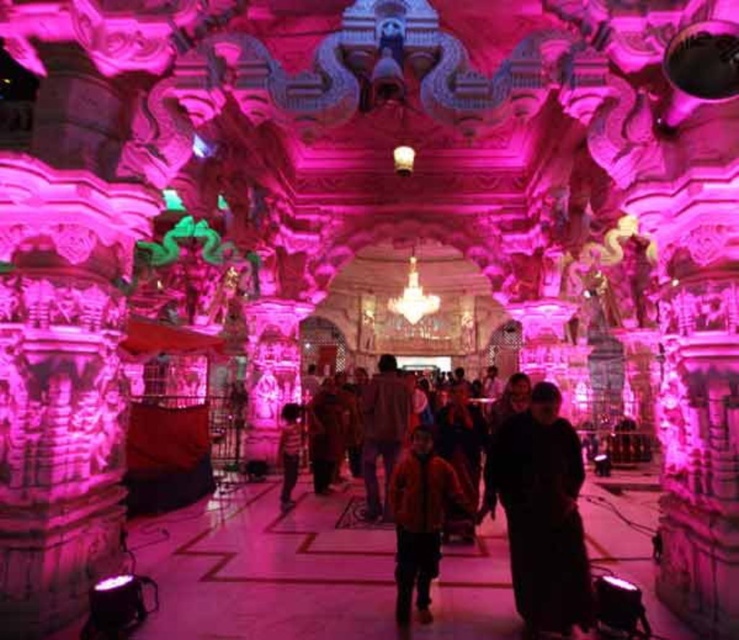
Is black matte dress at center shorter than striped shirt at center?

Incorrect, black matte dress at center's height does not fall short of striped shirt at center's.

Can you confirm if black matte dress at center is positioned below striped shirt at center?

No.

Find the location of a particular element. The image size is (739, 640). black matte dress at center is located at coordinates (541, 513).

Does orange fuzzy jacket at center appear on the right side of striped shirt at center?

Indeed, orange fuzzy jacket at center is positioned on the right side of striped shirt at center.

Which of these two, orange fuzzy jacket at center or striped shirt at center, stands taller?

orange fuzzy jacket at center

What do you see at coordinates (420, 520) in the screenshot? I see `orange fuzzy jacket at center` at bounding box center [420, 520].

The width and height of the screenshot is (739, 640). I want to click on orange fuzzy jacket at center, so click(420, 520).

Can you confirm if striped shirt at center is wider than matte white lamp at center?

Correct, the width of striped shirt at center exceeds that of matte white lamp at center.

Which is in front, point (290, 456) or point (401, 173)?

Point (290, 456) is in front.

Describe the element at coordinates (289, 451) in the screenshot. I see `striped shirt at center` at that location.

The width and height of the screenshot is (739, 640). What are the coordinates of `striped shirt at center` in the screenshot? It's located at (289, 451).